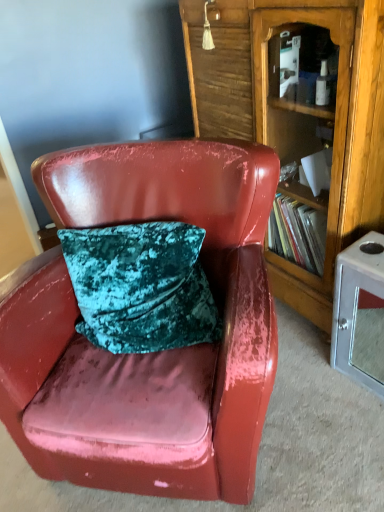
Question: Is metallic silver cabinet at lower right wider or thinner than glossy leather chair at center?

Choices:
 (A) thin
 (B) wide

Answer: (A)

Question: From the image's perspective, is metallic silver cabinet at lower right located above or below glossy leather chair at center?

Choices:
 (A) below
 (B) above

Answer: (A)

Question: Considering the real-world distances, which object is closest to the metallic silver cabinet at lower right?

Choices:
 (A) glossy leather chair at center
 (B) wooden bookcase at center

Answer: (B)

Question: Based on their relative distances, which object is nearer to the wooden bookcase at center?

Choices:
 (A) glossy leather chair at center
 (B) metallic silver cabinet at lower right

Answer: (B)